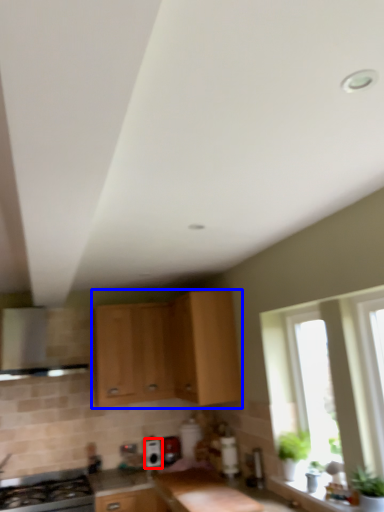
Question: Which point is further to the camera, appliance (highlighted by a red box) or cabinetry (highlighted by a blue box)?

Choices:
 (A) appliance
 (B) cabinetry

Answer: (A)